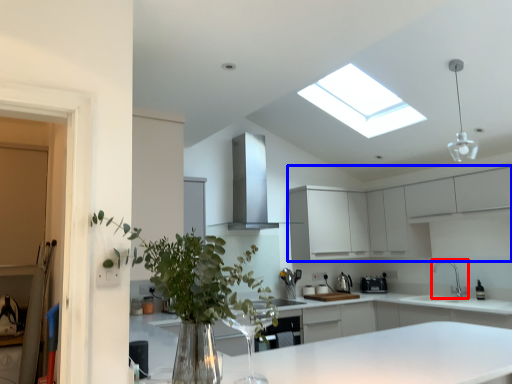
Question: Which object appears closest to the camera in this image, tap (highlighted by a red box) or cabinetry (highlighted by a blue box)?

Choices:
 (A) tap
 (B) cabinetry

Answer: (B)